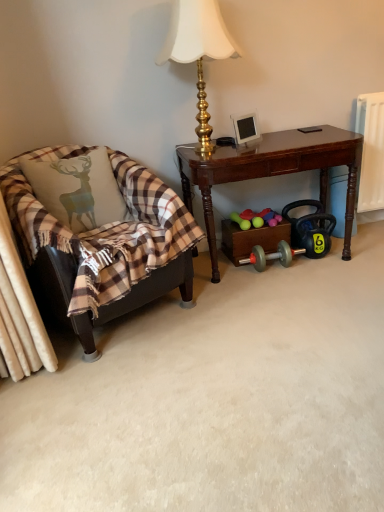
Question: Is plaid fabric pillow at left beside plaid fabric chair at left?

Choices:
 (A) yes
 (B) no

Answer: (B)

Question: Does plaid fabric pillow at left have a lesser height compared to plaid fabric chair at left?

Choices:
 (A) no
 (B) yes

Answer: (B)

Question: From a real-world perspective, is plaid fabric pillow at left over plaid fabric chair at left?

Choices:
 (A) no
 (B) yes

Answer: (B)

Question: Is plaid fabric pillow at left thinner than plaid fabric chair at left?

Choices:
 (A) no
 (B) yes

Answer: (B)

Question: Is plaid fabric pillow at left smaller than plaid fabric chair at left?

Choices:
 (A) no
 (B) yes

Answer: (B)

Question: From the image's perspective, is plaid fabric chair at left positioned above or below plaid fabric pillow at left?

Choices:
 (A) above
 (B) below

Answer: (B)

Question: Is plaid fabric chair at left taller or shorter than plaid fabric pillow at left?

Choices:
 (A) short
 (B) tall

Answer: (B)

Question: Is plaid fabric chair at left spatially inside plaid fabric pillow at left, or outside of it?

Choices:
 (A) inside
 (B) outside

Answer: (B)

Question: Does point (132, 202) appear closer or farther from the camera than point (92, 201)?

Choices:
 (A) closer
 (B) farther

Answer: (B)

Question: From the image's perspective, relative to gold metallic lamp at upper center, is dark wood desk at center above or below?

Choices:
 (A) above
 (B) below

Answer: (B)

Question: Considering the positions of point (342, 156) and point (200, 13), is point (342, 156) closer or farther from the camera than point (200, 13)?

Choices:
 (A) closer
 (B) farther

Answer: (B)

Question: Considering the relative positions of dark wood desk at center and gold metallic lamp at upper center in the image provided, is dark wood desk at center to the left or to the right of gold metallic lamp at upper center?

Choices:
 (A) left
 (B) right

Answer: (B)

Question: From their relative heights in the image, would you say dark wood desk at center is taller or shorter than gold metallic lamp at upper center?

Choices:
 (A) short
 (B) tall

Answer: (A)

Question: Is gold metallic lamp at upper center inside or outside of plaid fabric chair at left?

Choices:
 (A) inside
 (B) outside

Answer: (B)

Question: From a real-world perspective, is gold metallic lamp at upper center positioned above or below plaid fabric chair at left?

Choices:
 (A) above
 (B) below

Answer: (A)